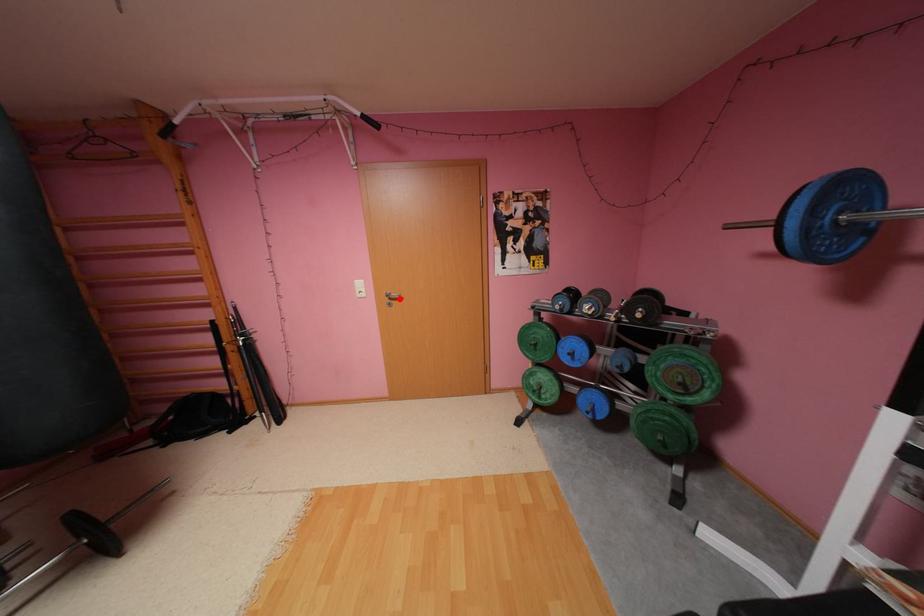
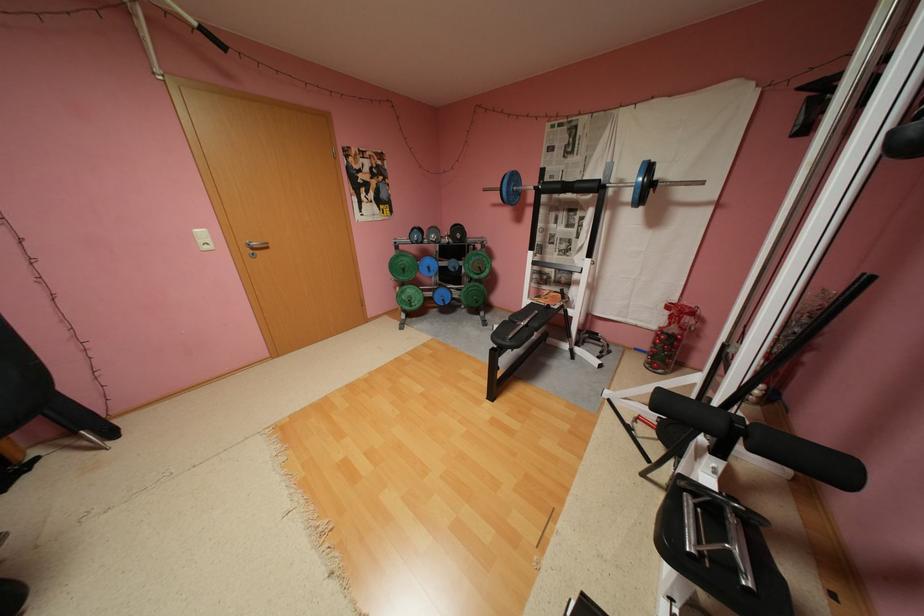
Locate, in the second image, the point that corresponds to the highlighted location in the first image.

(262, 249)